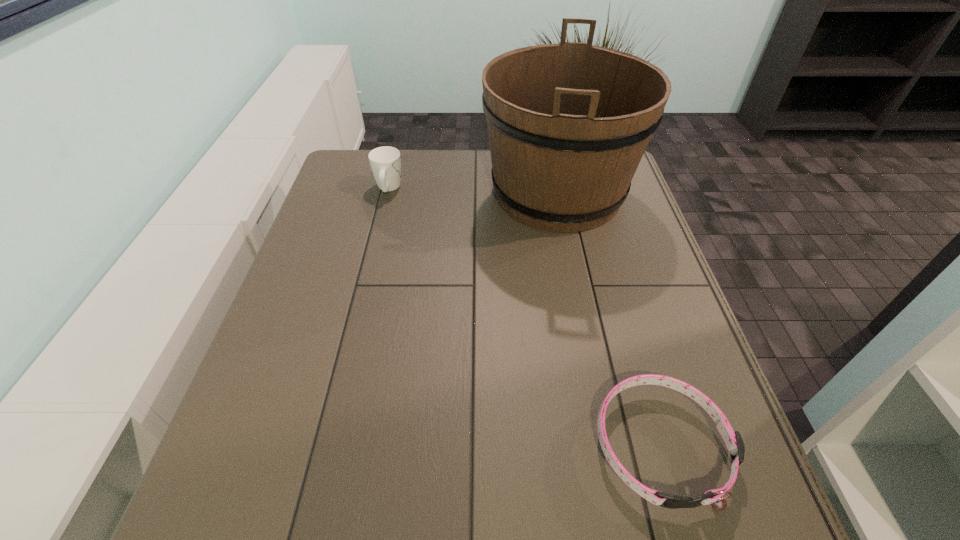
Identify the location of the tallest object. The height and width of the screenshot is (540, 960). (568, 124).

Locate an element on the screen. The height and width of the screenshot is (540, 960). the leftmost object is located at coordinates (385, 162).

Find the location of a particular element. the second shortest object is located at coordinates (385, 162).

At what (x,y) coordinates should I click in order to perform the action: click on the shortest object. Please return your answer as a coordinate pair (x, y). This screenshot has height=540, width=960. Looking at the image, I should click on (733, 440).

Locate an element on the screen. This screenshot has height=540, width=960. the nearest object is located at coordinates (733, 440).

Locate an element on the screen. vacant space located 0.120m on the front of the bucket is located at coordinates (575, 279).

The height and width of the screenshot is (540, 960). I want to click on free region located on the side of the second shortest object with the handle, so click(x=398, y=151).

Identify the location of vacant space situated on the side of the second shortest object with the handle. The width and height of the screenshot is (960, 540). (396, 160).

I want to click on free space located on the side of the second shortest object with the handle, so click(397, 152).

Image resolution: width=960 pixels, height=540 pixels. Find the location of `bucket that is at the far edge`. bucket that is at the far edge is located at coordinates (568, 124).